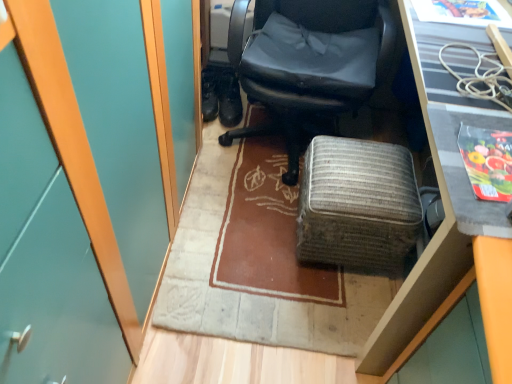
Find the location of a particular element. The image size is (512, 384). free space in front of matte black office chair at center is located at coordinates (246, 246).